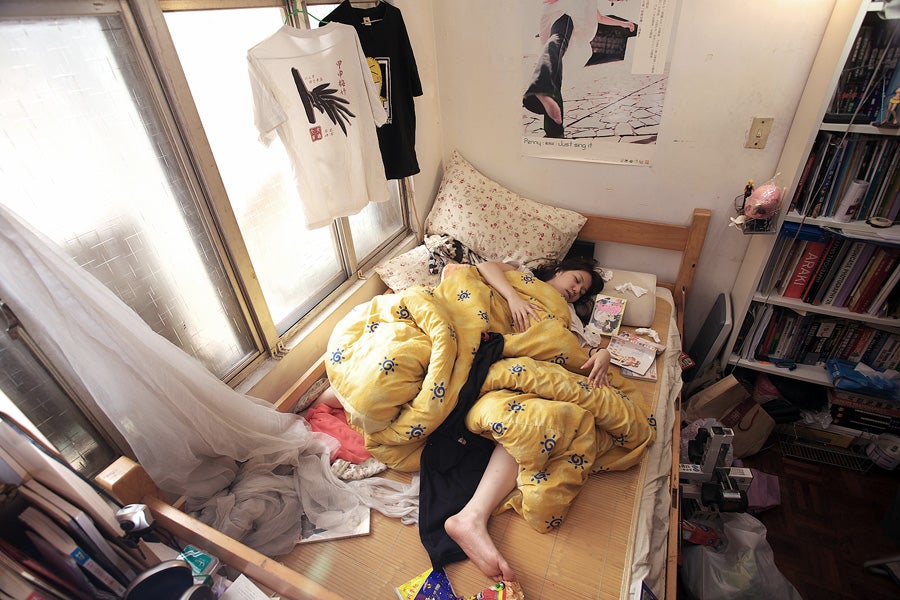
The width and height of the screenshot is (900, 600). What are the coordinates of `window` in the screenshot? It's located at (45, 164), (220, 87), (322, 8).